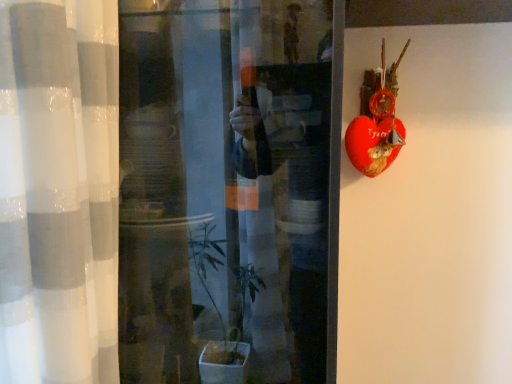
Where is `transparent glass window at center`? The image size is (512, 384). transparent glass window at center is located at coordinates (224, 189).

Image resolution: width=512 pixels, height=384 pixels. Describe the element at coordinates (224, 189) in the screenshot. I see `transparent glass window at center` at that location.

Locate an element on the screen. The height and width of the screenshot is (384, 512). transparent glass window at center is located at coordinates point(224,189).